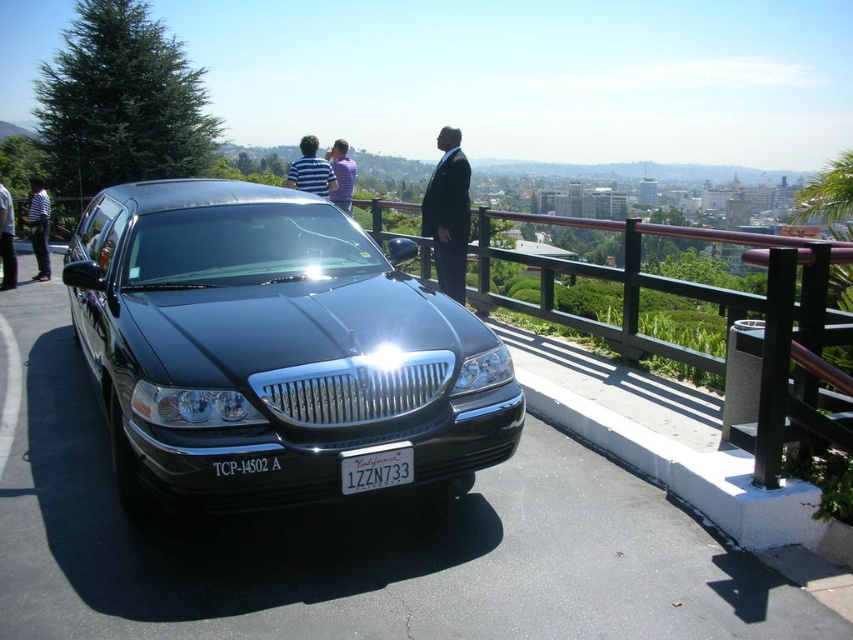
Question: Which object is the closest to the striped fabric shirt at upper center?

Choices:
 (A) striped cotton shirt at upper center
 (B) white plastic license plate at center
 (C) striped shirt at left
 (D) dark gray suit at center

Answer: (A)

Question: Is the position of black metallic car at center less distant than that of white plastic license plate at center?

Choices:
 (A) no
 (B) yes

Answer: (B)

Question: Which object is closer to the camera taking this photo?

Choices:
 (A) striped cotton shirt at upper center
 (B) striped fabric shirt at upper center
 (C) dark gray suit at center

Answer: (A)

Question: Does striped shirt at left appear over striped cotton shirt at upper center?

Choices:
 (A) no
 (B) yes

Answer: (A)

Question: Is dark suit at center wider than striped fabric shirt at upper center?

Choices:
 (A) yes
 (B) no

Answer: (B)

Question: Which is farther from the dark gray suit at center?

Choices:
 (A) striped fabric shirt at upper center
 (B) black metallic car at center

Answer: (B)